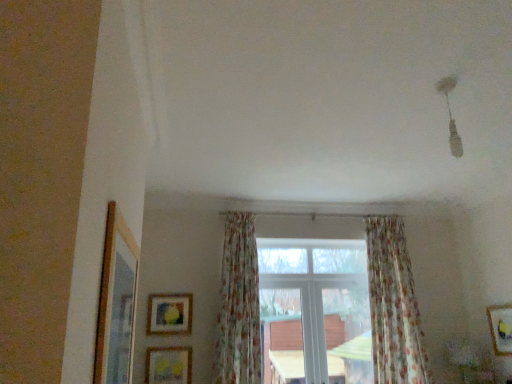
Question: Would you consider wooden framed picture at lower right, the 3th picture frame in the back-to-front sequence, to be distant from matte yellow picture frame at lower center, the third picture frame in the front-to-back sequence?

Choices:
 (A) yes
 (B) no

Answer: (A)

Question: From the image's perspective, is wooden framed picture at lower right, the first picture frame from the right, over matte yellow picture frame at lower center, which ranks as the 4th picture frame in top-to-bottom order?

Choices:
 (A) no
 (B) yes

Answer: (B)

Question: Is wooden framed picture at lower right, positioned as the third picture frame in top-to-bottom order, in contact with matte yellow picture frame at lower center, the third picture frame in the front-to-back sequence?

Choices:
 (A) no
 (B) yes

Answer: (A)

Question: Is matte yellow picture frame at lower center, marked as the 2th picture frame in a back-to-front arrangement, surrounded by wooden framed picture at lower right, which ranks as the 2th picture frame in front-to-back order?

Choices:
 (A) no
 (B) yes

Answer: (A)

Question: From a real-world perspective, is wooden framed picture at lower right, positioned as the third picture frame in top-to-bottom order, over matte yellow picture frame at lower center, positioned as the 3th picture frame in right-to-left order?

Choices:
 (A) yes
 (B) no

Answer: (A)

Question: Can you confirm if wooden framed picture at lower right, which is the fourth picture frame from left to right, is smaller than matte yellow picture frame at lower center, marked as the 2th picture frame in a back-to-front arrangement?

Choices:
 (A) yes
 (B) no

Answer: (B)

Question: Does matte yellow picture frame at lower center, positioned as the 3th picture frame in right-to-left order, lie behind wooden picture frame at left, placed as the 1th picture frame when sorted from front to back?

Choices:
 (A) yes
 (B) no

Answer: (A)

Question: Is matte yellow picture frame at lower center, marked as the 2th picture frame in a left-to-right arrangement, at the right side of wooden picture frame at left, the 1th picture frame when ordered from top to bottom?

Choices:
 (A) yes
 (B) no

Answer: (B)

Question: Is matte yellow picture frame at lower center, marked as the 2th picture frame in a left-to-right arrangement, taller than wooden picture frame at left, the 4th picture frame from the back?

Choices:
 (A) no
 (B) yes

Answer: (A)

Question: Is matte yellow picture frame at lower center, positioned as the 3th picture frame in right-to-left order, looking in the opposite direction of wooden picture frame at left, the 2th picture frame viewed from the right?

Choices:
 (A) no
 (B) yes

Answer: (A)

Question: Is matte yellow picture frame at lower center, the 1th picture frame from the bottom, to the left of wooden picture frame at left, the third picture frame when ordered from left to right, from the viewer's perspective?

Choices:
 (A) yes
 (B) no

Answer: (A)

Question: Considering the relative sizes of matte yellow picture frame at lower center, marked as the 2th picture frame in a back-to-front arrangement, and wooden picture frame at left, the 1th picture frame when ordered from top to bottom, in the image provided, is matte yellow picture frame at lower center, marked as the 2th picture frame in a back-to-front arrangement, shorter than wooden picture frame at left, the 1th picture frame when ordered from top to bottom,?

Choices:
 (A) yes
 (B) no

Answer: (A)

Question: From a real-world perspective, is wooden framed picture at lower right, the first picture frame from the right, positioned under white plastic window at center based on gravity?

Choices:
 (A) no
 (B) yes

Answer: (B)